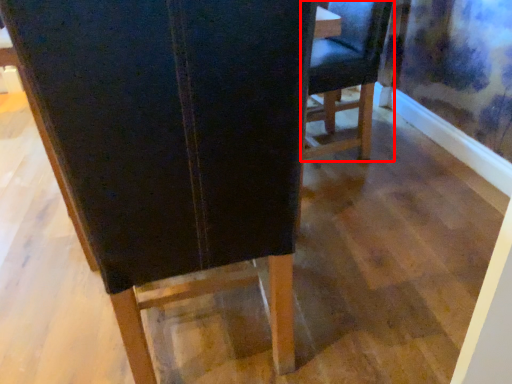
Question: From the image's perspective, what is the correct spatial positioning of chair (annotated by the red box) in reference to chair?

Choices:
 (A) below
 (B) above

Answer: (B)